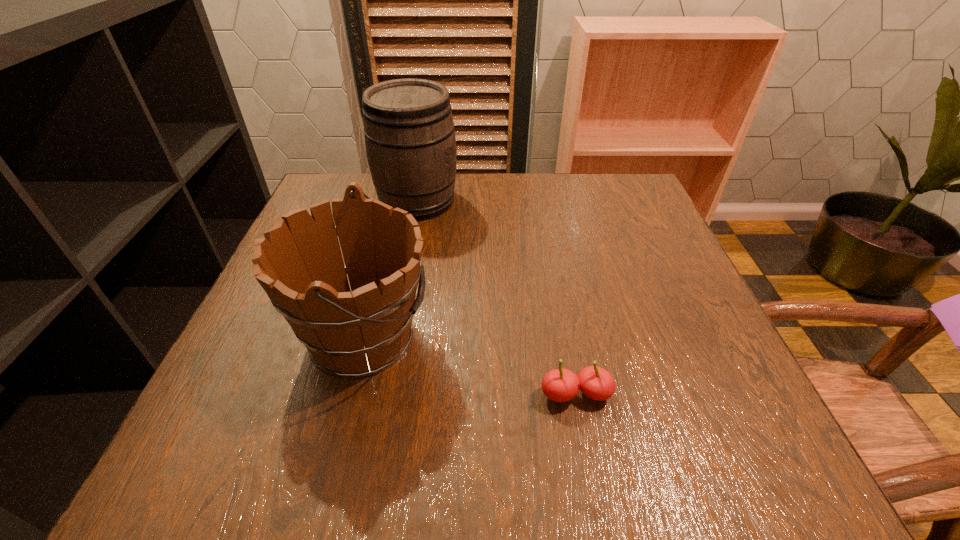
You are a GUI agent. You are given a task and a screenshot of the screen. Output one action in this format:
    pyautogui.click(x=<x>, y=<y>)
    Task: Click on the farthest object
    The image size is (960, 540).
    Given the screenshot: What is the action you would take?
    pyautogui.click(x=410, y=142)

The image size is (960, 540). In order to click on the nearer wine bucket in this screenshot , I will do `click(354, 333)`.

In order to click on the rightmost object in this screenshot , I will do `click(560, 385)`.

I want to click on cherry, so click(560, 385).

Find the location of `free point located on the left of the farthest object`. free point located on the left of the farthest object is located at coordinates (325, 200).

This screenshot has height=540, width=960. I want to click on free location located 0.140m with the handle on the nearer wine bucket, so click(x=511, y=338).

The width and height of the screenshot is (960, 540). I want to click on free spot located 0.240m on the left of the shortest object, so click(x=390, y=394).

Identify the location of object at the far edge. (410, 142).

I want to click on object that is at the left edge, so click(x=354, y=333).

This screenshot has width=960, height=540. I want to click on vacant space at the far edge of the desktop, so click(551, 177).